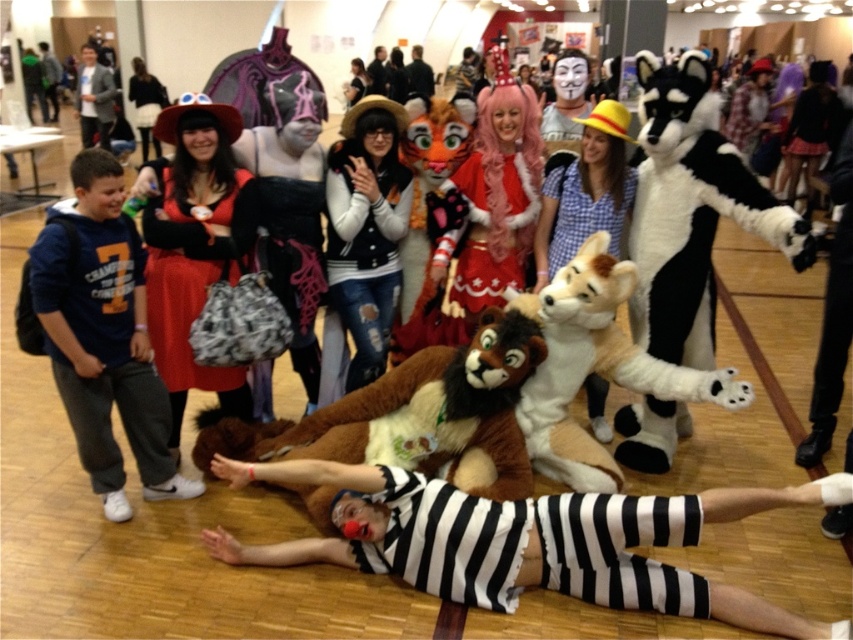
Question: Which point is farther to the camera?

Choices:
 (A) matte gray jacket at upper left
 (B) velvet red dress at center
 (C) black and white striped outfit at center
 (D) white striped fabric at center

Answer: (A)

Question: Does black and white plush raccoon at center have a larger size compared to fluffy brown and white plush at center?

Choices:
 (A) yes
 (B) no

Answer: (A)

Question: Which point is farther from the camera taking this photo?

Choices:
 (A) coord(627,342)
 (B) coord(91,96)
 (C) coord(160,284)
 (D) coord(80,164)

Answer: (B)

Question: Can you confirm if white striped fabric at center is positioned below velvet red dress at center?

Choices:
 (A) no
 (B) yes

Answer: (B)

Question: Does blue cotton hoodie at left appear over brown furry stuffed animal at center?

Choices:
 (A) yes
 (B) no

Answer: (A)

Question: Based on their relative distances, which object is farther from the velvet red dress at center?

Choices:
 (A) blue cotton hoodie at left
 (B) white fleece vest at center

Answer: (B)